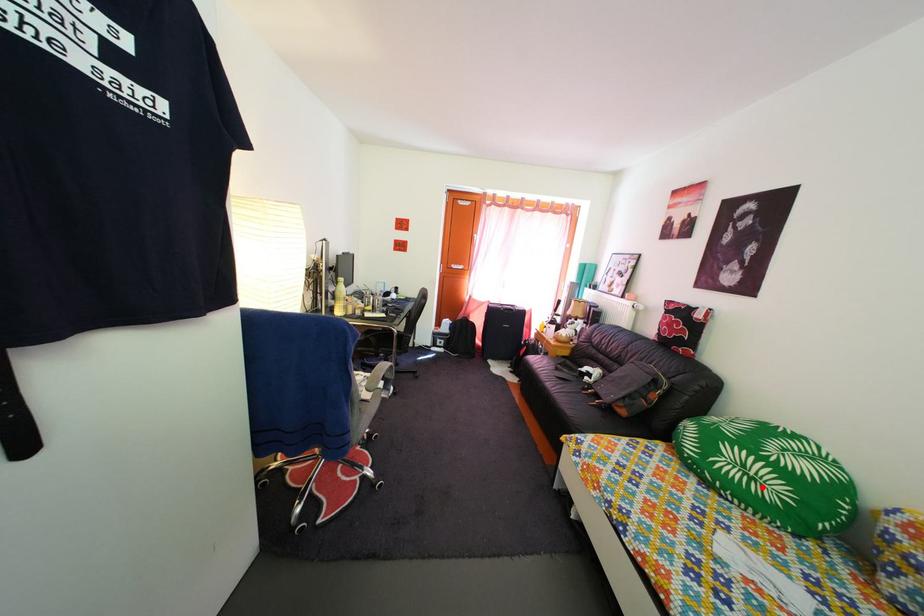
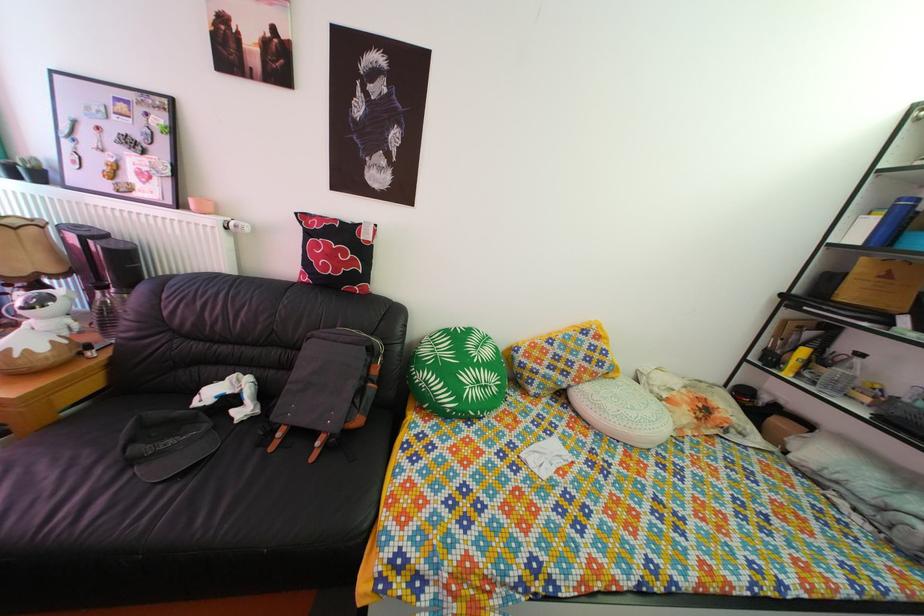
Question: I am providing you with two images of the same scene from different viewpoints. A red point is marked on the first image. At the location where the point appears in image 1, is it still visible in image 2?

Choices:
 (A) Yes
 (B) No

Answer: (A)